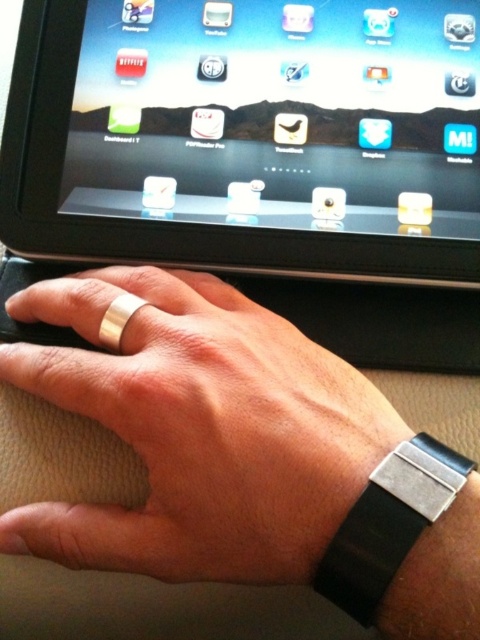
You are a robotic arm that needs to pick up the silver metallic ring at center without touching the black glossy tablet at upper center. What is the minimum distance you must maintain between the ring and the tablet?

The minimum distance you must maintain between the silver metallic ring at center and the black glossy tablet at upper center is 15.38 centimeters to avoid contact.

You are trying to place the silver metallic ring at center on top of the black glossy tablet at upper center. Will the ring fit entirely on the tablet without hanging over the edges?

The black glossy tablet at upper center is much taller than the silver metallic ring at center, so the ring should fit entirely on the tablet without hanging over the edges.

You are trying to reach for the black glossy tablet at upper center and the silver metallic ring at center. Which object is closer to your hand?

The black glossy tablet at upper center is closer to your hand because it is further to the viewer than the silver metallic ring at center.